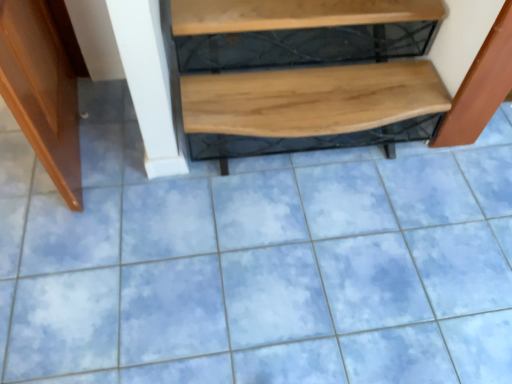
Locate an element on the screen. The width and height of the screenshot is (512, 384). unoccupied region to the right of wooden bench at right is located at coordinates (489, 155).